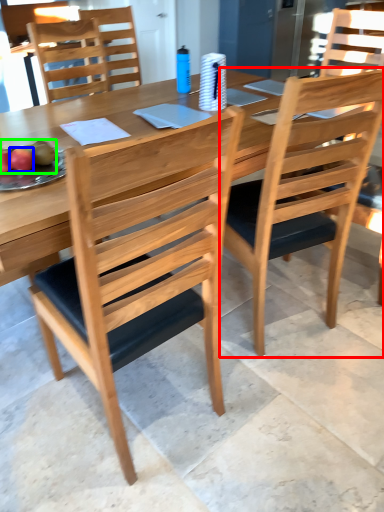
Question: Based on their relative distances, which object is nearer to chair (highlighted by a red box)? Choose from fruit (highlighted by a blue box) and fruit (highlighted by a green box).

Choices:
 (A) fruit
 (B) fruit

Answer: (B)